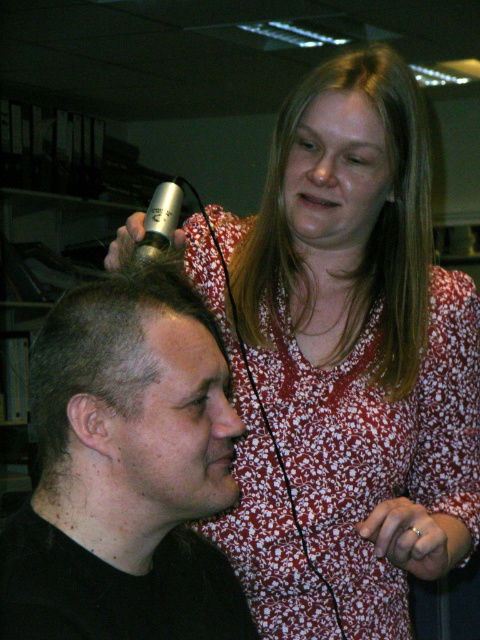
Question: Does matte silver hair clipper at upper center appear under smooth black hair at center?

Choices:
 (A) yes
 (B) no

Answer: (B)

Question: Based on their relative distances, which object is nearer to the smooth black hair at center?

Choices:
 (A) blonde smooth hair at upper center
 (B) matte silver hair clipper at upper center

Answer: (B)

Question: Is matte silver hair clipper at upper center positioned in front of smooth black hair at center?

Choices:
 (A) yes
 (B) no

Answer: (B)

Question: Can you confirm if matte silver hair clipper at upper center is smaller than smooth black hair at center?

Choices:
 (A) yes
 (B) no

Answer: (B)

Question: Which object is positioned closest to the smooth black hair at center?

Choices:
 (A) matte silver hair clipper at upper center
 (B) blonde smooth hair at upper center

Answer: (A)

Question: Which object is positioned farthest from the smooth black hair at center?

Choices:
 (A) blonde smooth hair at upper center
 (B) matte silver hair clipper at upper center

Answer: (A)